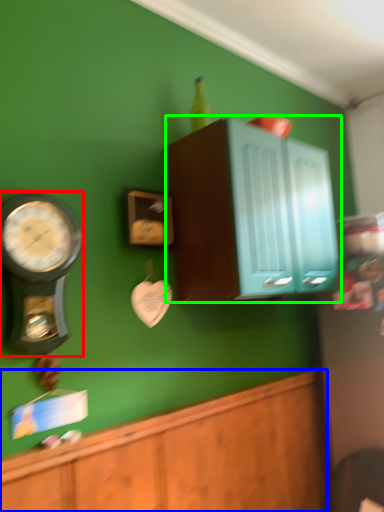
Question: Estimate the real-world distances between objects in this image. Which object is farther from wall clock (highlighted by a red box), cabinetry (highlighted by a blue box) or cabinetry (highlighted by a green box)?

Choices:
 (A) cabinetry
 (B) cabinetry

Answer: (B)